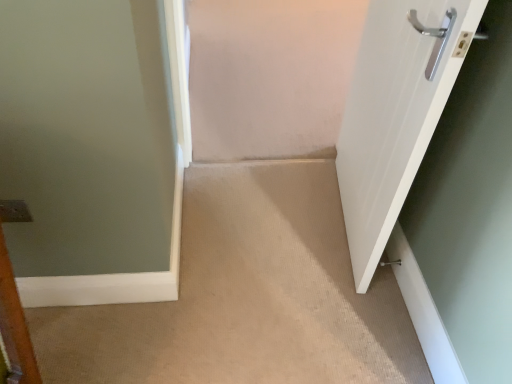
The height and width of the screenshot is (384, 512). What do you see at coordinates (246, 296) in the screenshot? I see `beige carpet at center` at bounding box center [246, 296].

Measure the distance between white glossy door at right and camera.

The distance of white glossy door at right from camera is 34.20 inches.

The image size is (512, 384). I want to click on satin silver door handle at lower right, so click(x=390, y=263).

Could you tell me if white glossy door at right is turned towards beige carpet at center?

Yes, white glossy door at right is turned towards beige carpet at center.

Can you confirm if white glossy door at right is bigger than beige carpet at center?

Yes, white glossy door at right is bigger than beige carpet at center.

From the picture: Can you confirm if white glossy door at right is positioned to the left of beige carpet at center?

In fact, white glossy door at right is to the right of beige carpet at center.

Is satin silver door handle at lower right oriented towards white glossy door at right?

No, satin silver door handle at lower right does not turn towards white glossy door at right.

From a real-world perspective, is satin silver door handle at lower right on top of white glossy door at right?

No, from a real-world perspective, satin silver door handle at lower right is not above white glossy door at right.

Which object is thinner, satin silver door handle at lower right or white glossy door at right?

satin silver door handle at lower right is thinner.

Is satin silver door handle at lower right far from white glossy door at right?

No, there isn't a large distance between satin silver door handle at lower right and white glossy door at right.

Does satin silver door handle at lower right have a greater width compared to beige carpet at center?

Incorrect, the width of satin silver door handle at lower right does not surpass that of beige carpet at center.

Considering the positions of objects satin silver door handle at lower right and beige carpet at center in the image provided, who is in front, satin silver door handle at lower right or beige carpet at center?

beige carpet at center is in front.

Is point (380, 265) closer to viewer compared to point (263, 231)?

Yes, it is.

Looking at this image, is there a large distance between satin silver door handle at lower right and beige carpet at center?

No, satin silver door handle at lower right is in close proximity to beige carpet at center.

What's the angular difference between beige carpet at center and satin silver door handle at lower right's facing directions?

88.3 degrees.

From the image's perspective, is beige carpet at center over satin silver door handle at lower right?

Yes, from the image's perspective, beige carpet at center is above satin silver door handle at lower right.

You are a GUI agent. You are given a task and a screenshot of the screen. Output one action in this format:
    pyautogui.click(x=<x>, y=<y>)
    Task: Click on the door handle lying behind the beige carpet at center
    
    Given the screenshot: What is the action you would take?
    pyautogui.click(x=390, y=263)

Is beige carpet at center positioned with its back to satin silver door handle at lower right?

beige carpet at center is not turned away from satin silver door handle at lower right.

Which is more to the left, white glossy door at right or satin silver door handle at lower right?

white glossy door at right is more to the left.

From a real-world perspective, is white glossy door at right positioned above or below satin silver door handle at lower right?

From a real-world perspective, white glossy door at right is physically above satin silver door handle at lower right.

Which object is further away from the camera taking this photo, white glossy door at right or satin silver door handle at lower right?

Positioned behind is satin silver door handle at lower right.

Which of these two, white glossy door at right or satin silver door handle at lower right, is bigger?

Bigger between the two is white glossy door at right.

Is beige carpet at center to the left or to the right of white glossy door at right in the image?

Clearly, beige carpet at center is on the left of white glossy door at right in the image.

From a real-world perspective, which object rests below the other?

In real-world perspective, beige carpet at center is lower.

Between beige carpet at center and white glossy door at right, which one is positioned behind?

beige carpet at center.

Is point (291, 200) behind point (431, 100)?

Yes, it is.

Locate an element on the screen. The image size is (512, 384). corridor below the white glossy door at right (from the image's perspective) is located at coordinates click(246, 296).

Where is `door in front of the satin silver door handle at lower right`? The image size is (512, 384). door in front of the satin silver door handle at lower right is located at coordinates (395, 113).

Which object lies further to the anchor point beige carpet at center, white glossy door at right or satin silver door handle at lower right?

satin silver door handle at lower right is further to beige carpet at center.

Based on their spatial positions, is white glossy door at right or beige carpet at center further from satin silver door handle at lower right?

Among the two, white glossy door at right is located further to satin silver door handle at lower right.

From the image, which object appears to be nearer to white glossy door at right, satin silver door handle at lower right or beige carpet at center?

beige carpet at center is positioned closer to the anchor white glossy door at right.

From the image, which object appears to be nearer to white glossy door at right, beige carpet at center or satin silver door handle at lower right?

beige carpet at center.

Based on their spatial positions, is satin silver door handle at lower right or white glossy door at right closer to beige carpet at center?

Among the two, white glossy door at right is located nearer to beige carpet at center.

Considering their positions, is beige carpet at center positioned closer to satin silver door handle at lower right than white glossy door at right?

The object closer to satin silver door handle at lower right is beige carpet at center.

Locate an element on the screen. The image size is (512, 384). corridor between white glossy door at right and satin silver door handle at lower right from front to back is located at coordinates (246, 296).